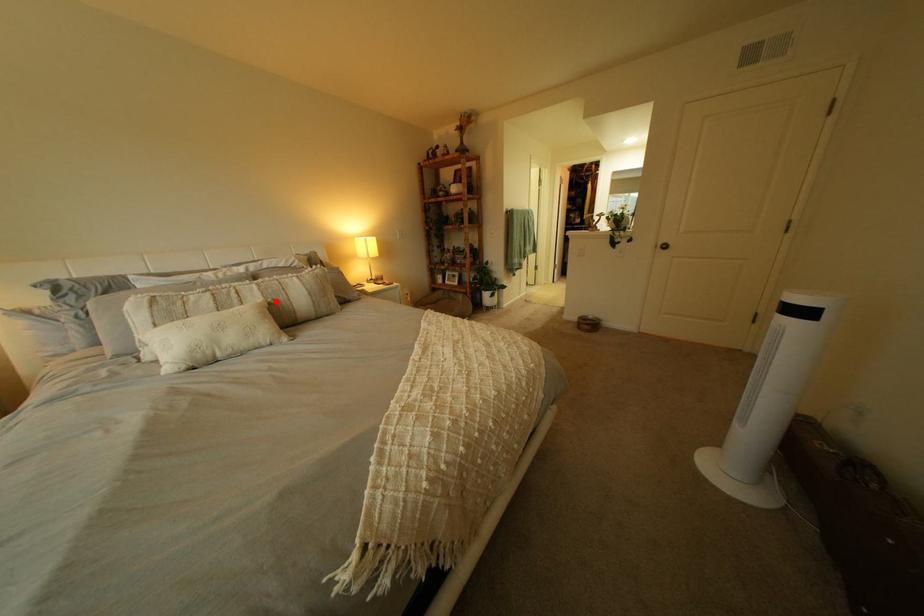
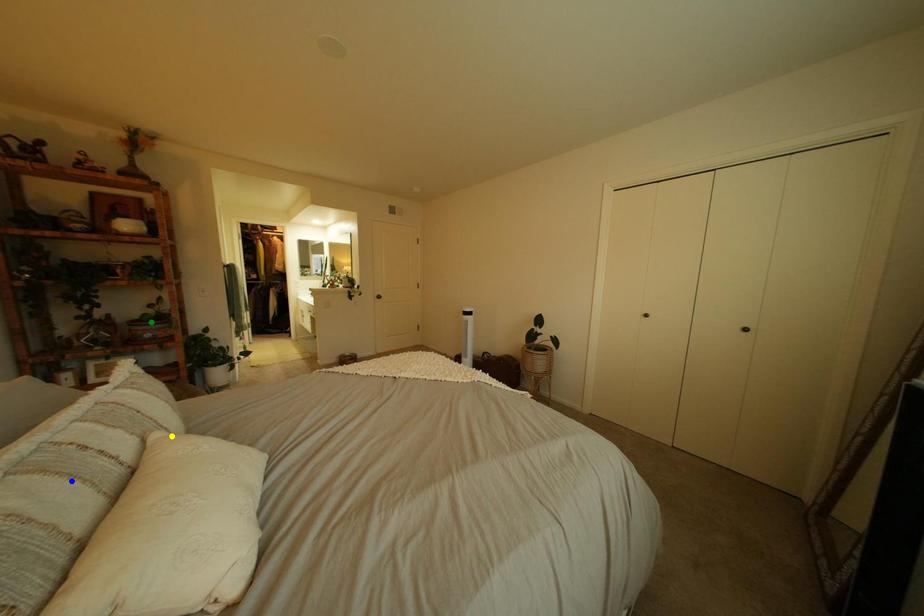
Question: I am providing you with two images of the same scene from different viewpoints. A red point is marked on the first image. You are given multiple points on the second image. Which point in image 2 represents the same 3d spot as the red point in image 1?

Choices:
 (A) yellow point
 (B) green point
 (C) blue point

Answer: (A)